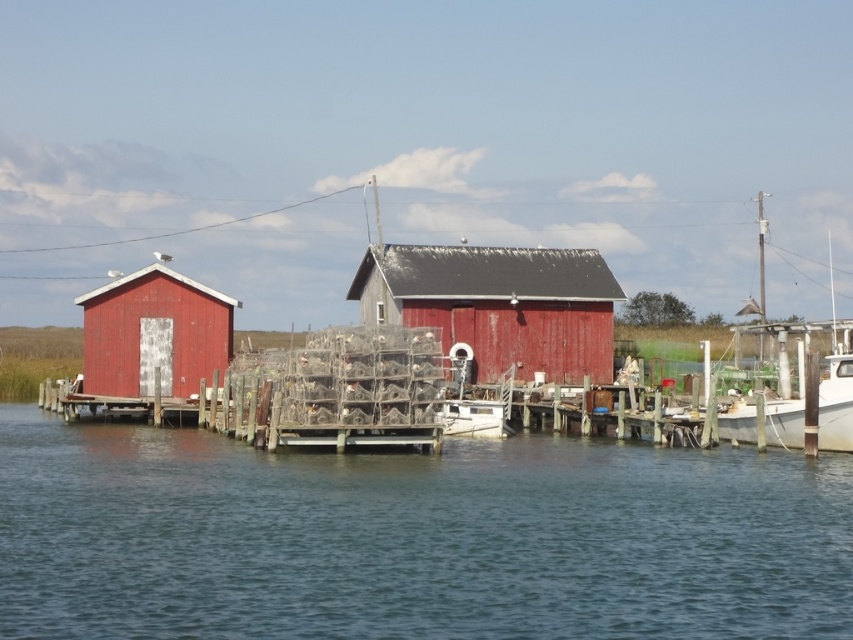
Consider the image. You are standing at the edge of the waterfront and want to determine which of the two points, point (418, 273) or point (758, 445), is closer to you. Based on the scene description, which point is nearer?

Result: Point (418, 273) is closer to you because it is further to the viewer than point (758, 445).

You are a fisherman who needs to reach the white glossy boat at right from the transparent water at center. Given that your small rowboat can only travel 30 feet, will you be able to reach it without rowing further?

The transparent water at center and white glossy boat at right are 40.60 feet apart from each other. Since your rowboat can only travel 30 feet, you will not be able to reach the white glossy boat at right without rowing further.